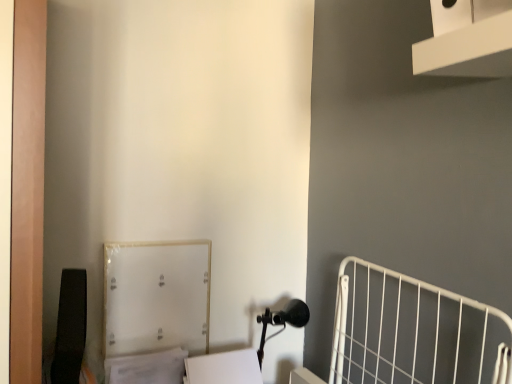
Find the location of a particular element. matte black table lamp at lower center is located at coordinates (282, 321).

This screenshot has width=512, height=384. Describe the element at coordinates (282, 321) in the screenshot. I see `matte black table lamp at lower center` at that location.

What are the coordinates of `matte black table lamp at lower center` in the screenshot? It's located at (282, 321).